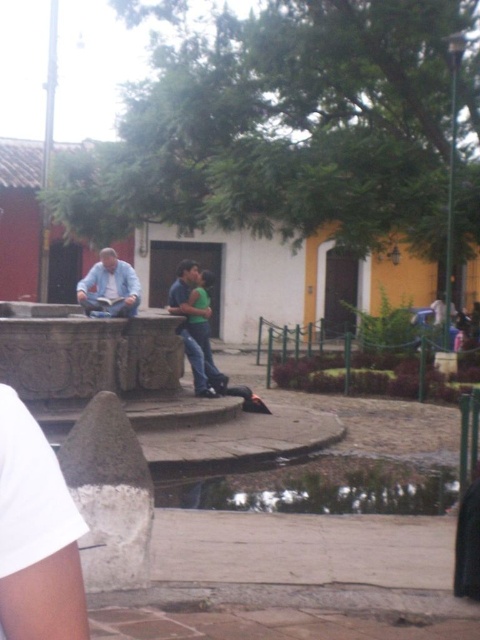
Measure the distance between clear water at lower center and camera.

clear water at lower center is 20.40 feet away from camera.

Which is more to the right, clear water at lower center or matte blue jeans at center?

clear water at lower center is more to the right.

Who is more forward, (x=176, y=500) or (x=203, y=381)?

Point (x=176, y=500) is in front.

Where is `clear water at lower center`? This screenshot has width=480, height=640. clear water at lower center is located at coordinates (324, 488).

Between clear water at lower center and light blue denim shirt at center, which one has more height?

light blue denim shirt at center

Which is more to the left, clear water at lower center or light blue denim shirt at center?

light blue denim shirt at center

What do you see at coordinates (324, 488) in the screenshot? The height and width of the screenshot is (640, 480). I see `clear water at lower center` at bounding box center [324, 488].

Where is `clear water at lower center`? Image resolution: width=480 pixels, height=640 pixels. clear water at lower center is located at coordinates (324, 488).

Image resolution: width=480 pixels, height=640 pixels. What do you see at coordinates (109, 285) in the screenshot? I see `light blue denim shirt at center` at bounding box center [109, 285].

Who is more distant from viewer, (86, 296) or (202, 385)?

Positioned behind is point (202, 385).

You are a GUI agent. You are given a task and a screenshot of the screen. Output one action in this format:
    pyautogui.click(x=<x>, y=<y>)
    Task: Click on the light blue denim shirt at center
    Image resolution: width=480 pixels, height=640 pixels.
    Given the screenshot: What is the action you would take?
    pyautogui.click(x=109, y=285)